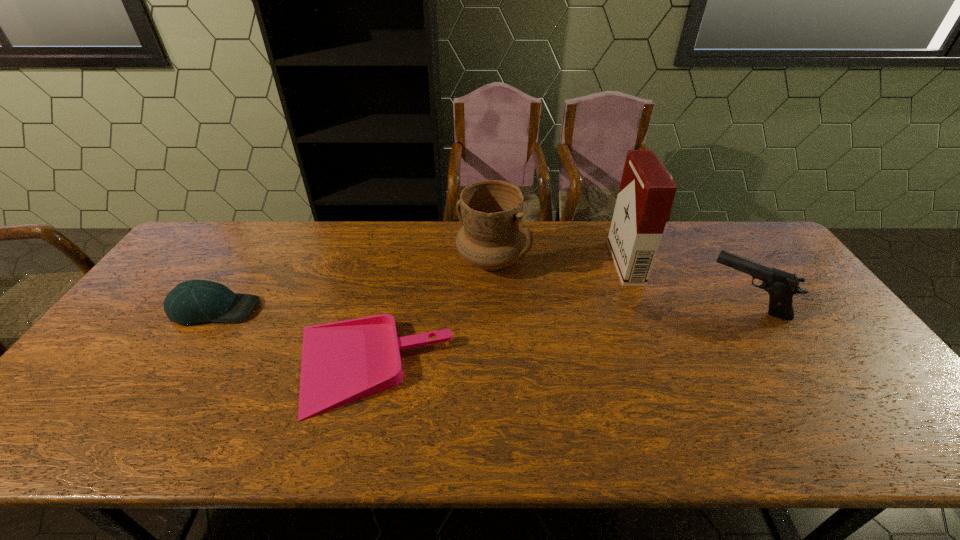
Find the location of a particular element. Image resolution: width=960 pixels, height=540 pixels. pottery that is at the far edge is located at coordinates (493, 235).

You are a GUI agent. You are given a task and a screenshot of the screen. Output one action in this format:
    pyautogui.click(x=<x>, y=<y>)
    Task: Click on the object that is at the near edge
    Image resolution: width=960 pixels, height=540 pixels.
    Given the screenshot: What is the action you would take?
    pyautogui.click(x=342, y=362)

What are the coordinates of `object positioned at the left edge` in the screenshot? It's located at click(195, 301).

Find the location of a particular element. The height and width of the screenshot is (540, 960). object that is at the right edge is located at coordinates (781, 286).

Identify the location of vacant space at the far edge. This screenshot has height=540, width=960. (244, 250).

In the image, there is a desktop. Identify the location of blank space at the near edge. (426, 426).

This screenshot has width=960, height=540. I want to click on vacant point at the right edge, so click(x=825, y=311).

In the image, there is a desktop. In order to click on vacant space at the far left corner in this screenshot , I will do `click(209, 263)`.

What are the coordinates of `vacant space at the near right corner` in the screenshot? It's located at (895, 431).

What are the coordinates of `vacant space that is in between the baseball cap and the second tallest object` in the screenshot? It's located at (353, 285).